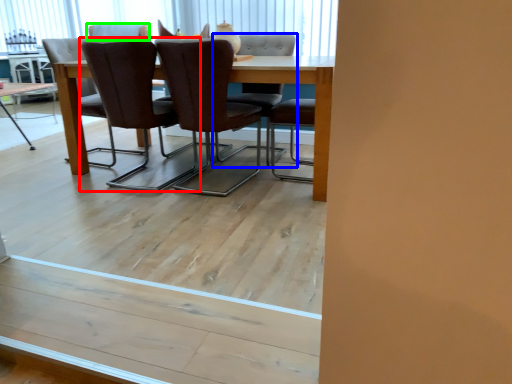
Question: Estimate the real-world distances between objects in this image. Which object is farther from chair (highlighted by a red box), chair (highlighted by a blue box) or chair (highlighted by a green box)?

Choices:
 (A) chair
 (B) chair

Answer: (A)